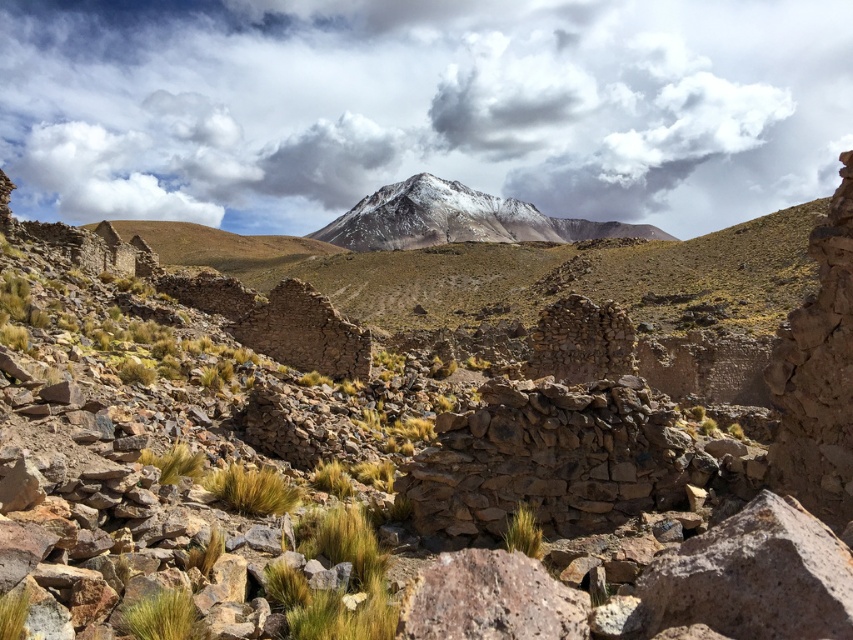
You are standing at the center of the arid landscape and want to find the green grass at lower left. Which direction should you face to locate it?

You should face the lower left direction to locate the green grass at lower left since it is located at point (164, 616).

You are standing at the edge of the ancient stone ruins and notice two patches of green grass at lower left and green grass at center. Which patch of grass is closer to you?

The green grass at lower left is closer to you because it is positioned in front of the green grass at center.